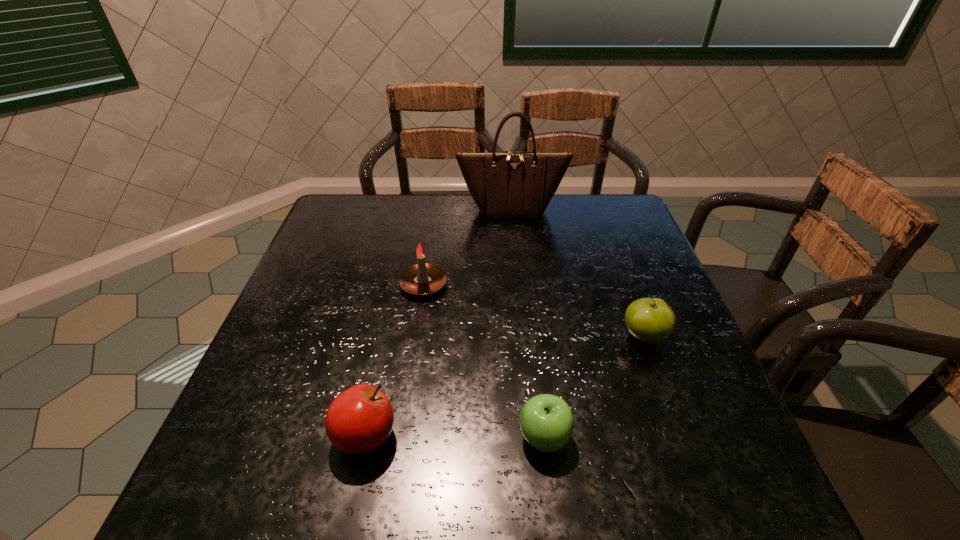
Where is `the third closest object to the candle`? The width and height of the screenshot is (960, 540). the third closest object to the candle is located at coordinates (546, 421).

Identify which object is located as the third nearest to the second apple from right to left. Please provide its 2D coordinates. Your answer should be formatted as a tuple, i.e. [(x, y)], where the tuple contains the x and y coordinates of a point satisfying the conditions above.

[(422, 279)]

Choose which apple is the third nearest neighbor to the farthest object. Please provide its 2D coordinates. Your answer should be formatted as a tuple, i.e. [(x, y)], where the tuple contains the x and y coordinates of a point satisfying the conditions above.

[(546, 421)]

At what (x,y) coordinates should I click in order to perform the action: click on apple that stands as the third closest to the second farthest object. Please return your answer as a coordinate pair (x, y). The height and width of the screenshot is (540, 960). Looking at the image, I should click on (650, 320).

Find the location of a particular element. blank area in the image that satisfies the following two spatial constraints: 1. on the back side of the rightmost apple; 2. on the left side of the leftmost apple is located at coordinates click(387, 337).

The height and width of the screenshot is (540, 960). Find the location of `free space in the image that satisfies the following two spatial constraints: 1. on the front-facing side of the rightmost apple; 2. on the right side of the handbag`. free space in the image that satisfies the following two spatial constraints: 1. on the front-facing side of the rightmost apple; 2. on the right side of the handbag is located at coordinates (524, 337).

What are the coordinates of `vacant space that satisfies the following two spatial constraints: 1. on the front-facing side of the rightmost object; 2. on the right side of the tallest object` in the screenshot? It's located at (524, 337).

This screenshot has height=540, width=960. I want to click on vacant space that satisfies the following two spatial constraints: 1. on the front-facing side of the farthest apple; 2. on the right side of the farthest object, so click(524, 337).

The width and height of the screenshot is (960, 540). Find the location of `free space that satisfies the following two spatial constraints: 1. on the front-facing side of the second apple from right to left; 2. on the left side of the handbag`. free space that satisfies the following two spatial constraints: 1. on the front-facing side of the second apple from right to left; 2. on the left side of the handbag is located at coordinates (534, 437).